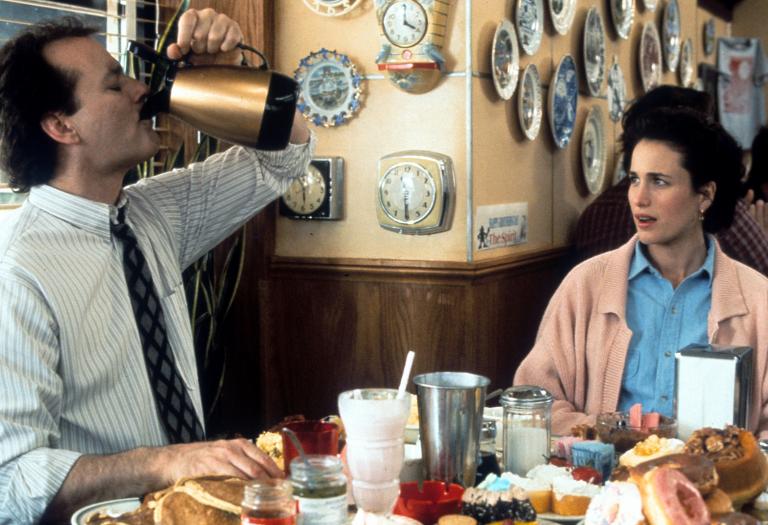
At what (x,y) coordinates should I click in order to perform the action: click on napkins. Please return your answer as a coordinate pair (x, y). Looking at the image, I should click on (700, 380).